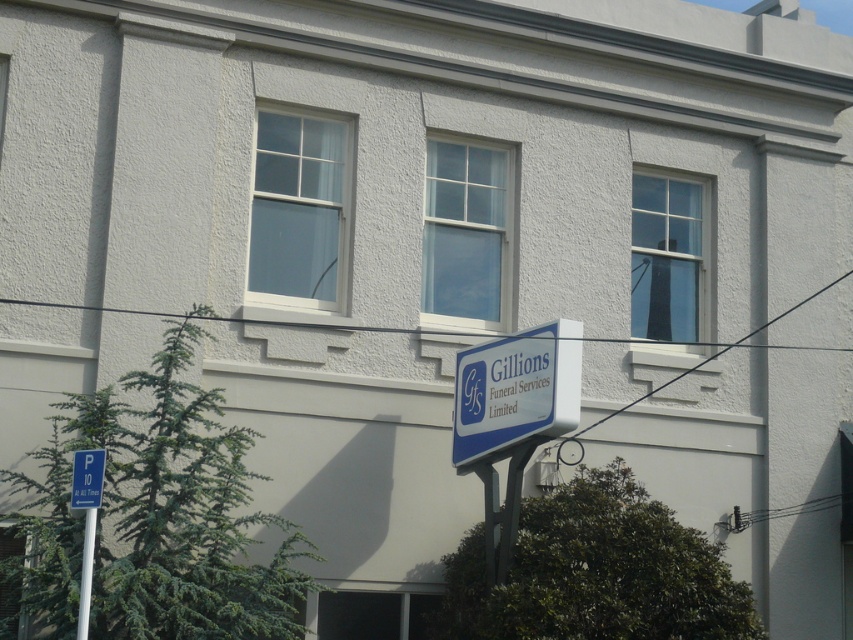
From the picture: You are a delivery driver who needs to park your vehicle near the building. You see the green plastic parking sign at lower left and the white plastic pole at lower left. Can you park your car between them without hitting either object?

The distance between the green plastic parking sign at lower left and the white plastic pole at lower left is 20.34 centimeters. Since the distance is very narrow, a standard car cannot fit between them. Therefore, you should not attempt to park between these two objects.

You are a delivery driver who needs to park your vehicle near the blue plastic sign at center and the white plastic pole at lower left. Since you want to park as close as possible to the signboard, which object should you park next to and why?

You should park next to the blue plastic sign at center because its width is larger than the white plastic pole at lower left, providing a more stable and visible parking spot closer to the signboard.

Looking at this image, you are standing in front of the building and want to locate the blue plastic sign at center. According to the coordinates provided, where exactly would you find it?

The blue plastic sign at center is located at coordinates point [515,392].